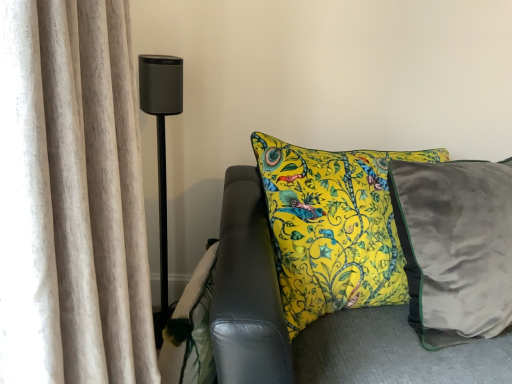
Image resolution: width=512 pixels, height=384 pixels. What do you see at coordinates (71, 198) in the screenshot? I see `beige textured curtain at left` at bounding box center [71, 198].

What are the coordinates of `beige textured curtain at left` in the screenshot? It's located at (71, 198).

Identify the location of matte black speaker at left. (161, 150).

What is the approximate width of matte black speaker at left?

matte black speaker at left is 7.44 inches in width.

The height and width of the screenshot is (384, 512). Describe the element at coordinates (161, 150) in the screenshot. I see `matte black speaker at left` at that location.

This screenshot has width=512, height=384. I want to click on beige textured curtain at left, so click(71, 198).

Can you confirm if matte black speaker at left is positioned to the left of beige textured curtain at left?

Correct, you'll find matte black speaker at left to the left of beige textured curtain at left.

Is matte black speaker at left in front of or behind beige textured curtain at left in the image?

Visually, matte black speaker at left is located behind beige textured curtain at left.

Does point (165, 147) come in front of point (39, 141)?

No, (165, 147) is behind (39, 141).

From the image's perspective, would you say matte black speaker at left is shown under beige textured curtain at left?

No, from the image's perspective, matte black speaker at left is not beneath beige textured curtain at left.

From a real-world perspective, is matte black speaker at left physically below beige textured curtain at left?

Yes.

Does matte black speaker at left have a greater width compared to beige textured curtain at left?

In fact, matte black speaker at left might be narrower than beige textured curtain at left.

Considering the sizes of objects matte black speaker at left and beige textured curtain at left in the image provided, who is shorter, matte black speaker at left or beige textured curtain at left?

beige textured curtain at left is shorter.

Considering the relative sizes of matte black speaker at left and beige textured curtain at left in the image provided, is matte black speaker at left smaller than beige textured curtain at left?

Correct, matte black speaker at left occupies less space than beige textured curtain at left.

Is matte black speaker at left not inside beige textured curtain at left?

Yes.

Is matte black speaker at left next to beige textured curtain at left and touching it?

No, matte black speaker at left is not in contact with beige textured curtain at left.

Is matte black speaker at left oriented away from beige textured curtain at left?

No, matte black speaker at left is not facing away from beige textured curtain at left.

How many degrees apart are the facing directions of matte black speaker at left and beige textured curtain at left?

There is a 87.3-degree angle between the facing directions of matte black speaker at left and beige textured curtain at left.

This screenshot has height=384, width=512. I want to click on table lamp on the left of beige textured curtain at left, so click(x=161, y=150).

Considering the positions of objects beige textured curtain at left and matte black speaker at left in the image provided, who is more to the left, beige textured curtain at left or matte black speaker at left?

Positioned to the left is matte black speaker at left.

In the image, is beige textured curtain at left positioned in front of or behind matte black speaker at left?

Visually, beige textured curtain at left is located in front of matte black speaker at left.

Considering the points (18, 5) and (162, 166), which point is behind, point (18, 5) or point (162, 166)?

The point (162, 166) is farther from the camera.

From the image's perspective, between beige textured curtain at left and matte black speaker at left, who is located below?

From the image's view, beige textured curtain at left is below.

From a real-world perspective, is beige textured curtain at left under matte black speaker at left?

Incorrect, from a real-world perspective, beige textured curtain at left is higher than matte black speaker at left.

Is beige textured curtain at left wider or thinner than matte black speaker at left?

beige textured curtain at left is wider than matte black speaker at left.

Is beige textured curtain at left taller than matte black speaker at left?

In fact, beige textured curtain at left may be shorter than matte black speaker at left.

Is beige textured curtain at left smaller than matte black speaker at left?

Actually, beige textured curtain at left might be larger than matte black speaker at left.

Is beige textured curtain at left completely or partially outside of matte black speaker at left?

beige textured curtain at left lies outside matte black speaker at left's area.

Are beige textured curtain at left and matte black speaker at left far apart?

No.

Is beige textured curtain at left oriented away from matte black speaker at left?

No, beige textured curtain at left is not facing the opposite direction of matte black speaker at left.

I want to click on table lamp on the left of beige textured curtain at left, so click(x=161, y=150).

Locate an element on the screen. Image resolution: width=512 pixels, height=384 pixels. table lamp behind the beige textured curtain at left is located at coordinates (161, 150).

Locate an element on the screen. This screenshot has width=512, height=384. curtain above the matte black speaker at left (from a real-world perspective) is located at coordinates (71, 198).